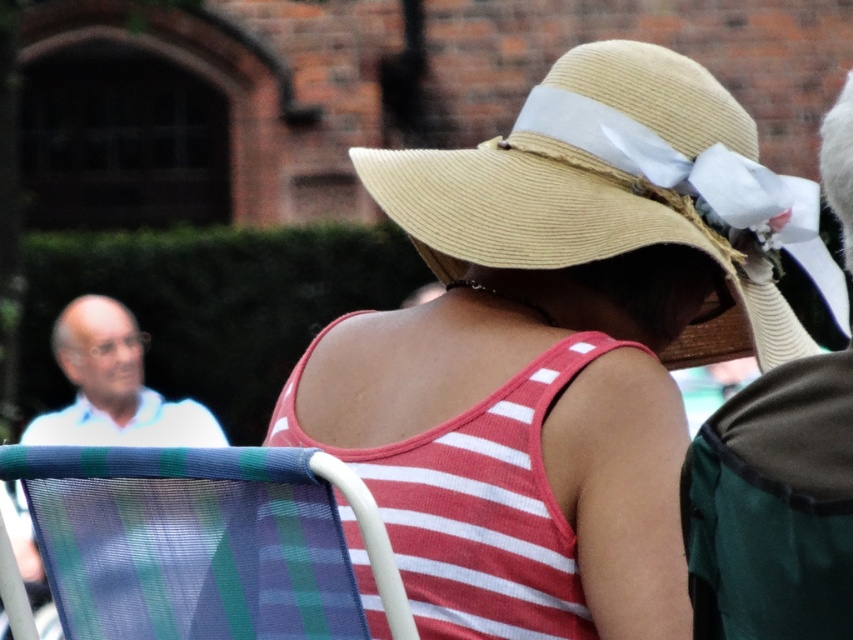
You are standing in the outdoor event scene and want to pick up the natural straw hat at center and the beige straw hat at upper center. Which hat can you reach first without moving your position?

The natural straw hat at center can be reached first because it is closer to you than the beige straw hat at upper center.

You are standing in the outdoor event scene described. You see a point at coordinates (531, 385). What object is located at that point?

The object at point (531, 385) is the straw hat at center.